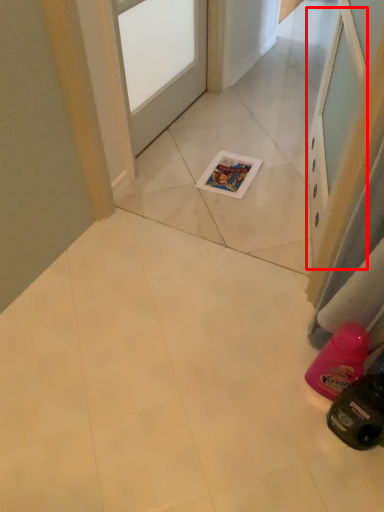
Question: From the image's perspective, what is the correct spatial positioning of screen door (annotated by the red box) in reference to door?

Choices:
 (A) below
 (B) above

Answer: (A)